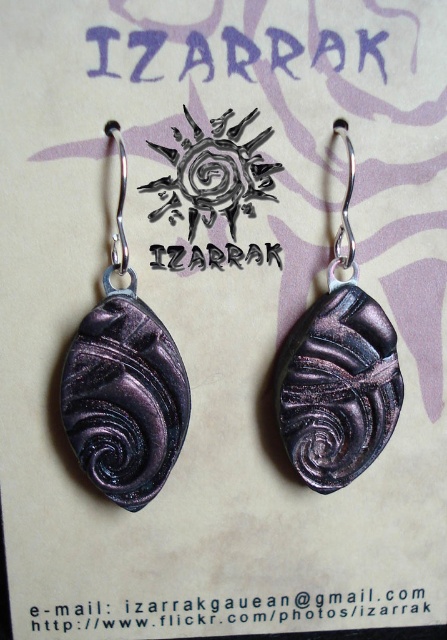
You are an appraiser examining the earrings. You need to determine which of the purple metallic swirls at left or metallic purple swirls at center is taller. Based on the description, which one is taller?

The purple metallic swirls at left is much taller than the metallic purple swirls at center.